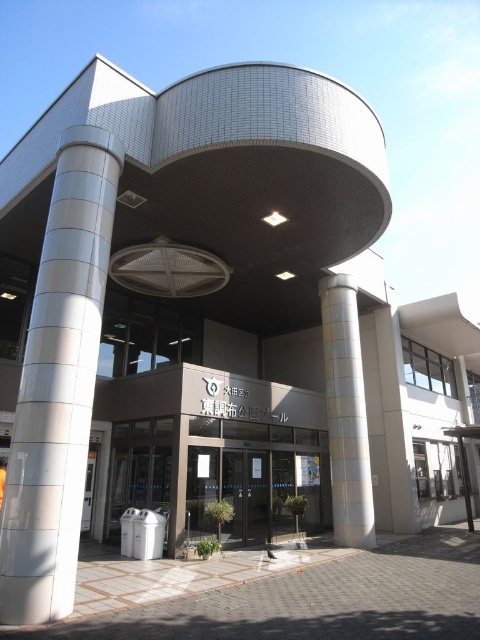
Question: Which point is closer to the camera taking this photo?

Choices:
 (A) (335, 369)
 (B) (75, 198)

Answer: (B)

Question: Can you confirm if white glossy column at left is positioned below white textured pillar at center?

Choices:
 (A) yes
 (B) no

Answer: (B)

Question: Is white glossy column at left to the left of white textured pillar at center from the viewer's perspective?

Choices:
 (A) yes
 (B) no

Answer: (A)

Question: Which point is farther from the camera taking this photo?

Choices:
 (A) (360, 397)
 (B) (22, 525)

Answer: (A)

Question: Does white glossy column at left have a smaller size compared to white textured pillar at center?

Choices:
 (A) yes
 (B) no

Answer: (A)